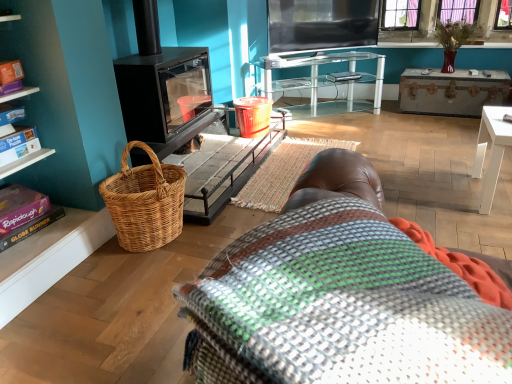
Find the location of a particular element. Image resolution: width=512 pixels, height=384 pixels. free space in front of rustic wooden trunk at upper right is located at coordinates (448, 128).